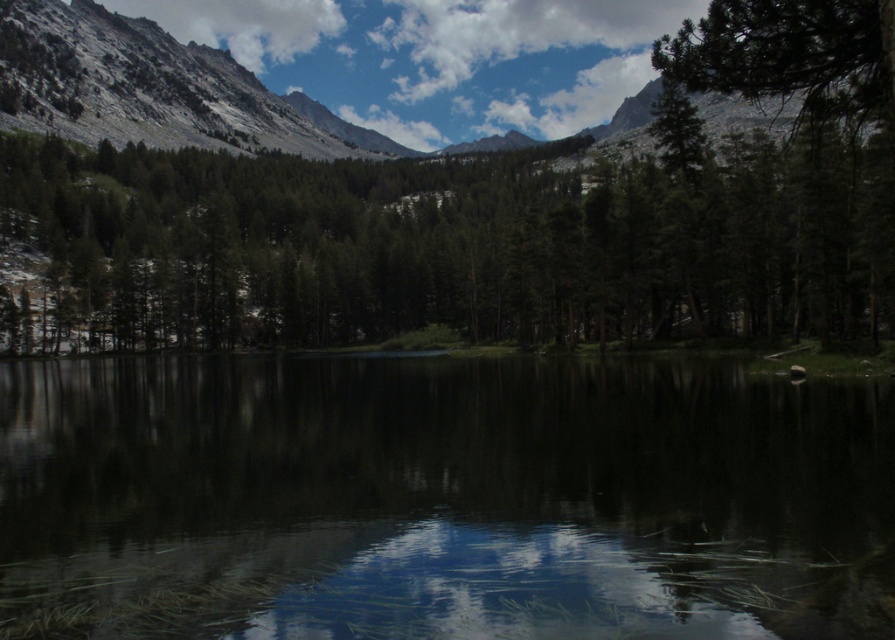
Question: Does smooth reflective water at center appear on the right side of green matte tree at center?

Choices:
 (A) no
 (B) yes

Answer: (A)

Question: Which object appears closest to the camera in this image?

Choices:
 (A) green matte tree at center
 (B) smooth reflective water at center

Answer: (B)

Question: Can you confirm if smooth reflective water at center is wider than green matte tree at center?

Choices:
 (A) yes
 (B) no

Answer: (B)

Question: Is smooth reflective water at center positioned behind green matte tree at center?

Choices:
 (A) no
 (B) yes

Answer: (A)

Question: Which object appears farthest from the camera in this image?

Choices:
 (A) smooth reflective water at center
 (B) green matte tree at center

Answer: (B)